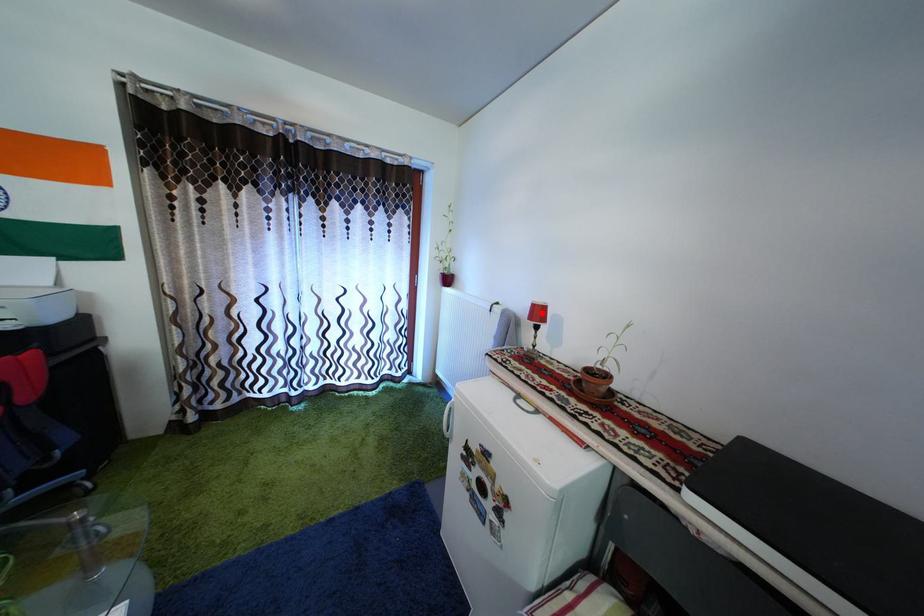
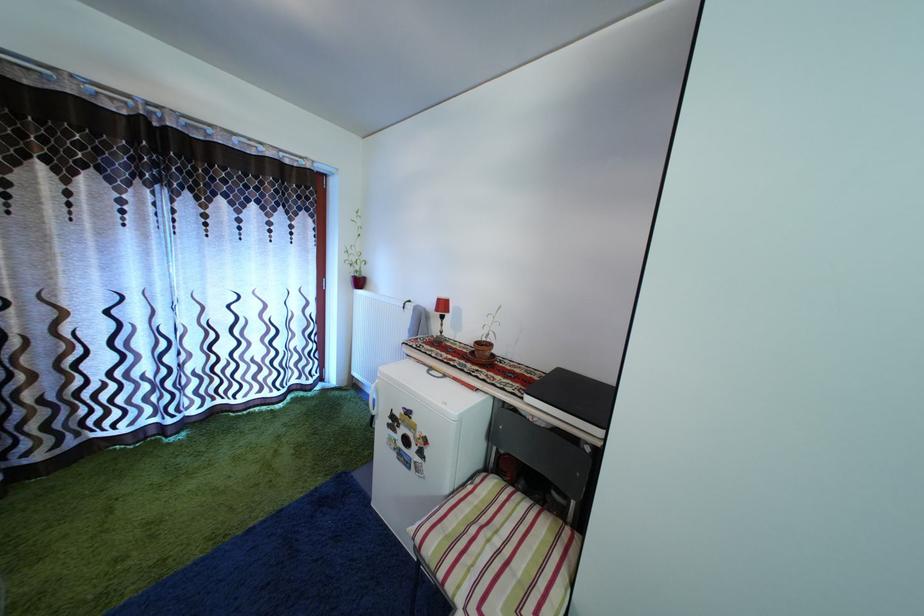
The point at the highlighted location is marked in the first image. Where is the corresponding point in the second image?

(446, 308)